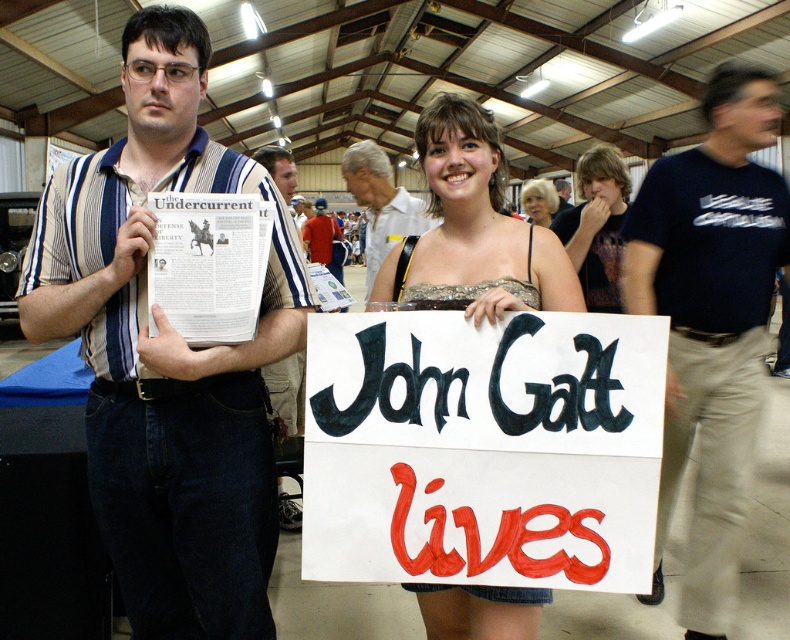
Question: Is white paper sign at center thinner than striped fabric shirt at center?

Choices:
 (A) yes
 (B) no

Answer: (B)

Question: Considering the real-world distances, which object is closest to the dark blue t-shirt at center?

Choices:
 (A) white shirt at center
 (B) smooth brown hair at center

Answer: (B)

Question: Considering the relative positions of matte gold dress at center and white shirt at center in the image provided, where is matte gold dress at center located with respect to white shirt at center?

Choices:
 (A) below
 (B) above

Answer: (A)

Question: Considering the real-world distances, which object is farthest from the smooth brown hair at center?

Choices:
 (A) white shirt at center
 (B) striped fabric shirt at left

Answer: (B)

Question: Which of these objects is positioned farthest from the smooth blonde hair at center?

Choices:
 (A) smooth brown hair at center
 (B) white shirt at center
 (C) striped fabric shirt at left

Answer: (C)

Question: Is smooth brown hair at center further to camera compared to white shirt at center?

Choices:
 (A) yes
 (B) no

Answer: (B)